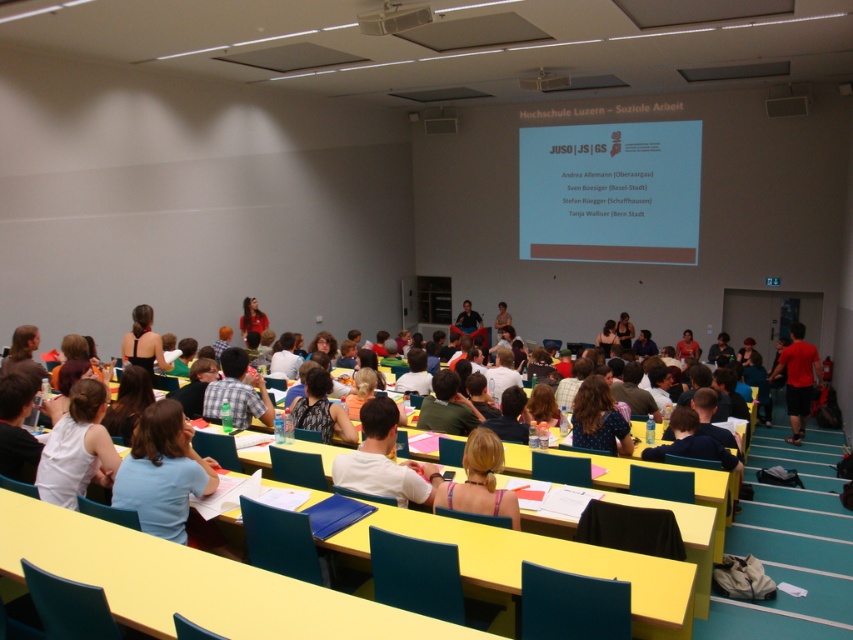
In the lecture hall at Hochschule Luzern for the Soziale Arbeit course, you notice a point at coordinates [610,192]. Which object in the scene does this point belong to?

The point at coordinates [610,192] is on the white matte projector screen at upper center.

In the lecture hall scene, you notice two individuals wearing a white fabric shirt at lower left and a dark blue shirt at center. Which person is sitting closer to the front of the lecture hall?

The white fabric shirt at lower left is sitting closer to the front of the lecture hall because it is positioned below the dark blue shirt at center, indicating a lower row or closer proximity to the front.